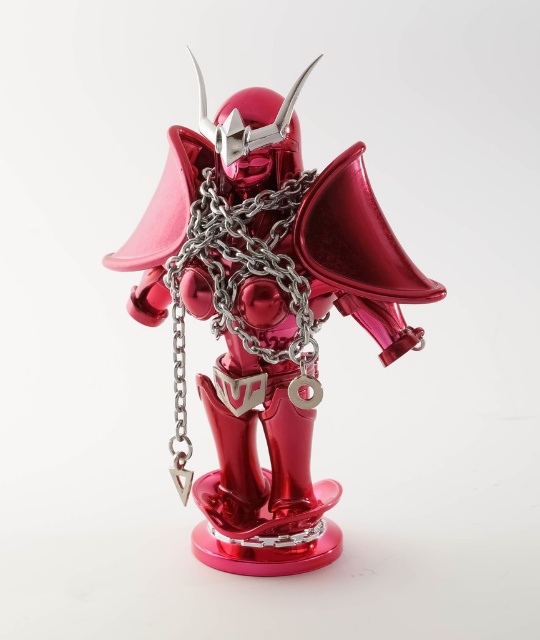
Question: Is metallic red armor at center below metallic silver chain at center?

Choices:
 (A) yes
 (B) no

Answer: (A)

Question: Is metallic red armor at center above metallic silver chain at center?

Choices:
 (A) no
 (B) yes

Answer: (A)

Question: Which of the following is the closest to the observer?

Choices:
 (A) coord(264,352)
 (B) coord(258,321)

Answer: (B)

Question: Which point is closer to the camera?

Choices:
 (A) (320, 515)
 (B) (274, 241)

Answer: (B)

Question: Can you confirm if metallic red armor at center is positioned above metallic silver chain at center?

Choices:
 (A) no
 (B) yes

Answer: (A)